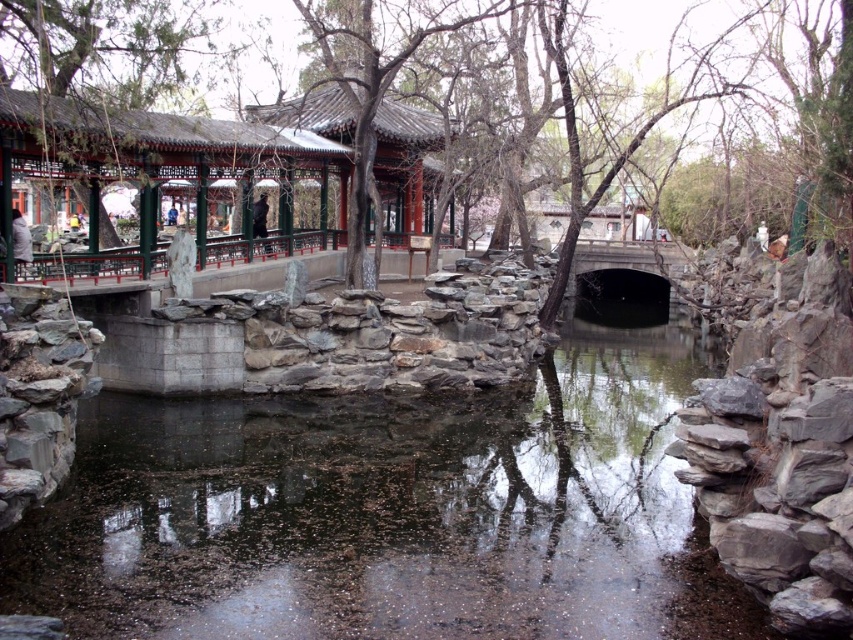
Can you confirm if transparent water at center is positioned to the left of matte red wood pavilion at upper left?

In fact, transparent water at center is to the right of matte red wood pavilion at upper left.

Is transparent water at center further to the viewer compared to matte red wood pavilion at upper left?

No, transparent water at center is in front of matte red wood pavilion at upper left.

Does point (647, 497) come farther from viewer compared to point (405, 205)?

No.

Locate an element on the screen. The width and height of the screenshot is (853, 640). transparent water at center is located at coordinates [x=376, y=508].

Who is taller, matte red wood pavilion at upper left or smooth bark tree at center?

With more height is smooth bark tree at center.

Where is `matte red wood pavilion at upper left`? The image size is (853, 640). matte red wood pavilion at upper left is located at coordinates (178, 168).

Is point (233, 122) behind point (149, 65)?

No, it is not.

In order to click on matte red wood pavilion at upper left in this screenshot , I will do `click(178, 168)`.

Which is more to the left, transparent water at center or smooth bark tree at center?

transparent water at center

Is point (498, 426) in front of point (689, 52)?

Yes, point (498, 426) is closer to viewer.

Locate an element on the screen. The height and width of the screenshot is (640, 853). transparent water at center is located at coordinates (376, 508).